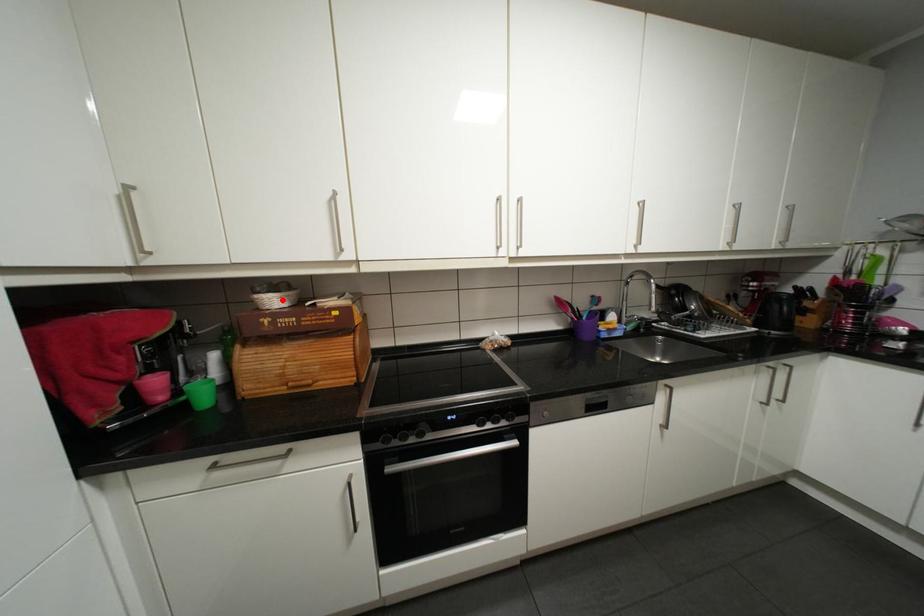
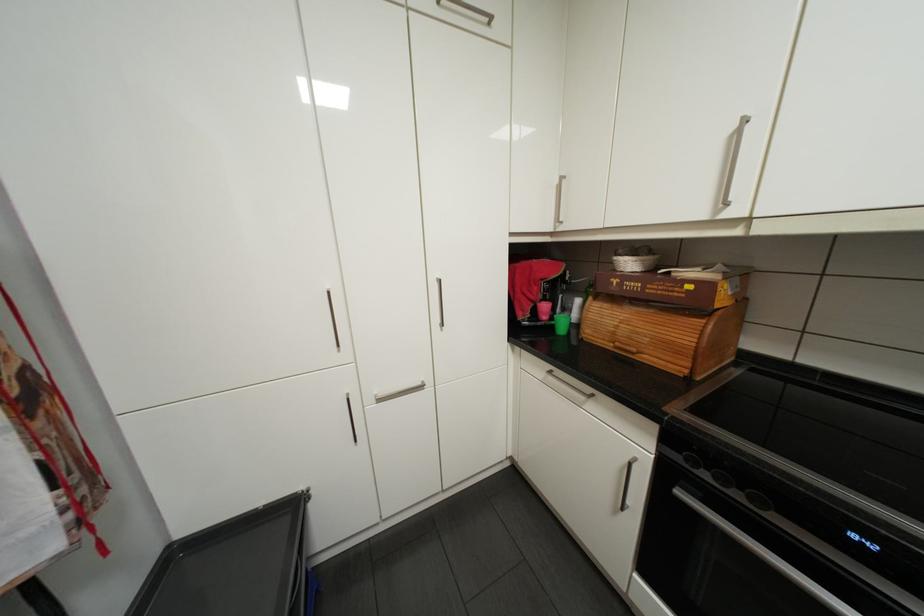
Where in the second image is the point corresponding to the highlighted location from the first image?

(637, 262)